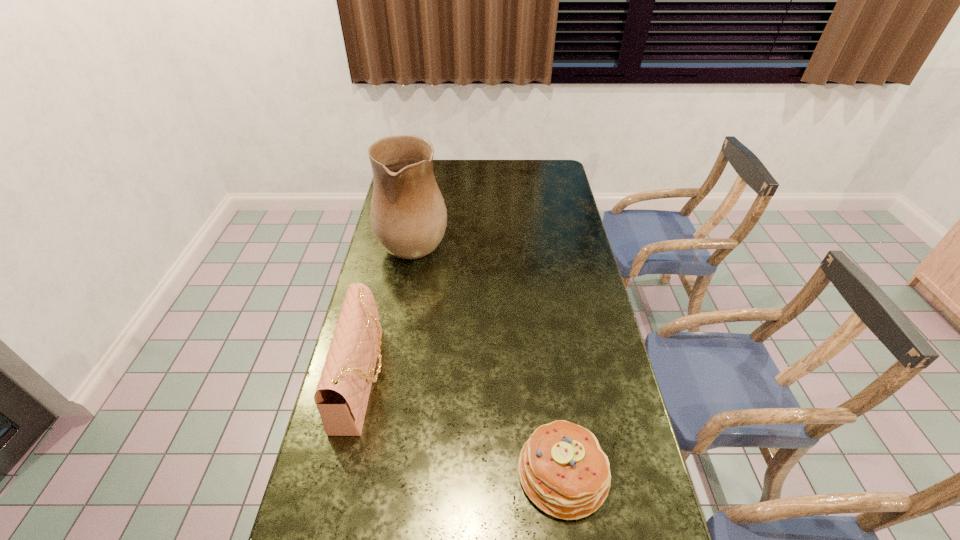
This screenshot has width=960, height=540. In order to click on object at the right edge in this screenshot , I will do `click(562, 468)`.

Locate an element on the screen. This screenshot has height=540, width=960. vacant space at the far edge of the desktop is located at coordinates (499, 166).

The height and width of the screenshot is (540, 960). Find the location of `vacant space at the right edge`. vacant space at the right edge is located at coordinates (597, 296).

Locate an element on the screen. This screenshot has width=960, height=540. vacant space at the far right corner of the desktop is located at coordinates click(537, 165).

Where is `free point between the rightmost object and the second tallest object`? The height and width of the screenshot is (540, 960). free point between the rightmost object and the second tallest object is located at coordinates (463, 426).

This screenshot has height=540, width=960. Identify the location of unoccupied area between the second tallest object and the pancake. (463, 426).

This screenshot has height=540, width=960. I want to click on vacant region between the pancake and the second shortest object, so click(x=463, y=426).

Find the location of a particular element. Image resolution: width=960 pixels, height=540 pixels. unoccupied area between the second tallest object and the rightmost object is located at coordinates (463, 426).

You are a GUI agent. You are given a task and a screenshot of the screen. Output one action in this format:
    pyautogui.click(x=<x>, y=<y>)
    Task: Click on the vacant area that lies between the pancake and the tallest object
    The height and width of the screenshot is (540, 960).
    Given the screenshot: What is the action you would take?
    pyautogui.click(x=489, y=355)

Where is `empty space that is in between the tallest object and the rightmost object`? Image resolution: width=960 pixels, height=540 pixels. empty space that is in between the tallest object and the rightmost object is located at coordinates (489, 355).